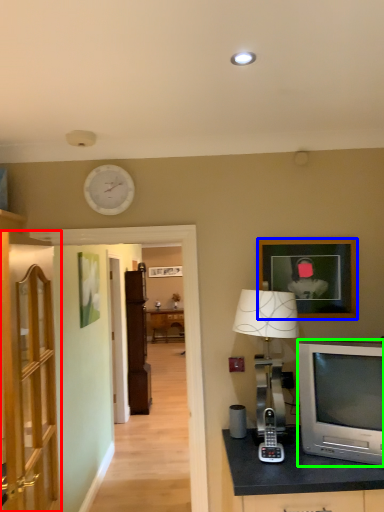
Question: Considering the real-world distances, which object is farthest from cabinetry (highlighted by a red box)? picture frame (highlighted by a blue box) or television (highlighted by a green box)?

Choices:
 (A) picture frame
 (B) television

Answer: (A)